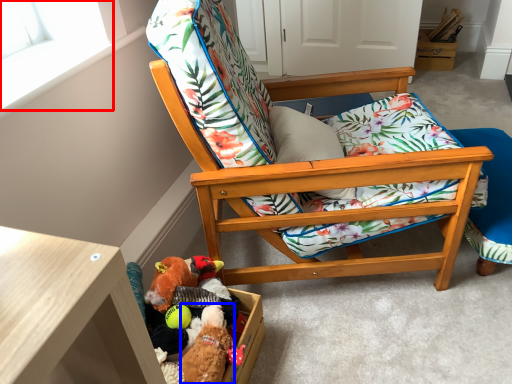
Question: Which of the following is the farthest to the observer, window screen (highlighted by a red box) or toy (highlighted by a blue box)?

Choices:
 (A) window screen
 (B) toy

Answer: (B)